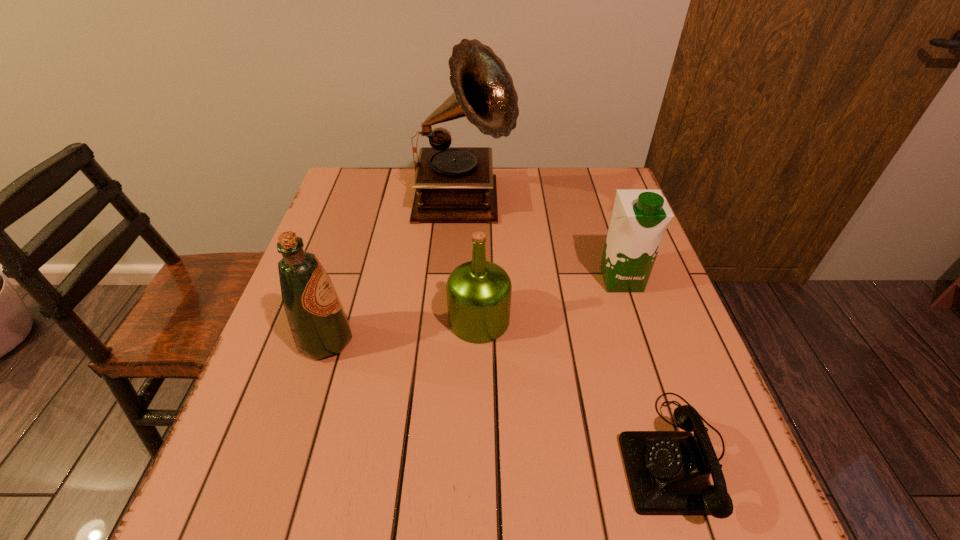
Image resolution: width=960 pixels, height=540 pixels. Identify the location of free spot between the record player and the nearest object. (569, 330).

This screenshot has height=540, width=960. Identify the location of object that is the second nearest to the taller olive oil. (453, 184).

This screenshot has height=540, width=960. In order to click on object that is the fourth closest to the taller olive oil in this screenshot , I will do `click(640, 218)`.

Locate an element on the screen. This screenshot has height=540, width=960. free location that satisfies the following two spatial constraints: 1. on the front-facing side of the second farthest object; 2. on the front face of the telephone is located at coordinates (679, 455).

Locate an element on the screen. This screenshot has width=960, height=540. vacant space that satisfies the following two spatial constraints: 1. on the front-facing side of the soya milk; 2. on the front face of the nearest object is located at coordinates (679, 455).

Locate an element on the screen. The image size is (960, 540). free spot that satisfies the following two spatial constraints: 1. on the front-facing side of the fourth nearest object; 2. on the front-facing side of the left olive oil is located at coordinates (641, 341).

In order to click on vacant position in the image that satisfies the following two spatial constraints: 1. on the horn of the record player; 2. on the left side of the shorter olive oil in this screenshot , I will do `click(458, 320)`.

Locate an element on the screen. The image size is (960, 540). vacant area in the image that satisfies the following two spatial constraints: 1. on the front-facing side of the soya milk; 2. on the front-facing side of the taller olive oil is located at coordinates (641, 341).